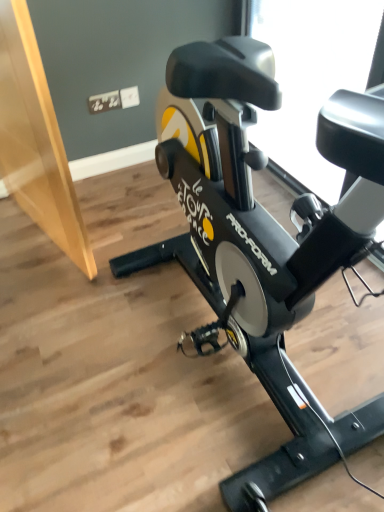
Question: Is transparent glass window at upper center taller or shorter than black matte stationary bicycle at center?

Choices:
 (A) tall
 (B) short

Answer: (B)

Question: Which is correct: transparent glass window at upper center is inside black matte stationary bicycle at center, or outside of it?

Choices:
 (A) outside
 (B) inside

Answer: (A)

Question: Looking at the image, does transparent glass window at upper center seem bigger or smaller compared to black matte stationary bicycle at center?

Choices:
 (A) small
 (B) big

Answer: (A)

Question: In the image, is black matte stationary bicycle at center on the left side or the right side of transparent glass window at upper center?

Choices:
 (A) left
 (B) right

Answer: (A)

Question: Looking at the image, does black matte stationary bicycle at center seem bigger or smaller compared to transparent glass window at upper center?

Choices:
 (A) small
 (B) big

Answer: (B)

Question: From a real-world perspective, is black matte stationary bicycle at center positioned above or below transparent glass window at upper center?

Choices:
 (A) below
 (B) above

Answer: (B)

Question: Considering their positions, is black matte stationary bicycle at center located in front of or behind transparent glass window at upper center?

Choices:
 (A) behind
 (B) front

Answer: (B)